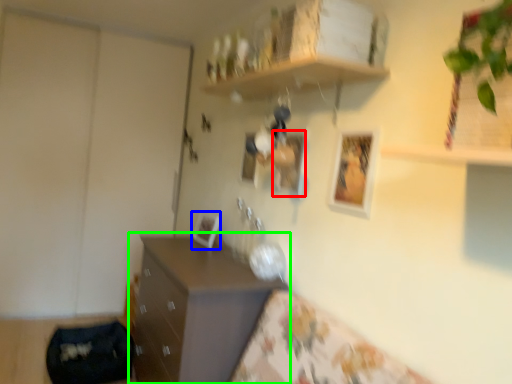
Question: Which is farther away from picture frame (highlighted by a red box)? picture frame (highlighted by a blue box) or chest of drawers (highlighted by a green box)?

Choices:
 (A) picture frame
 (B) chest of drawers

Answer: (B)